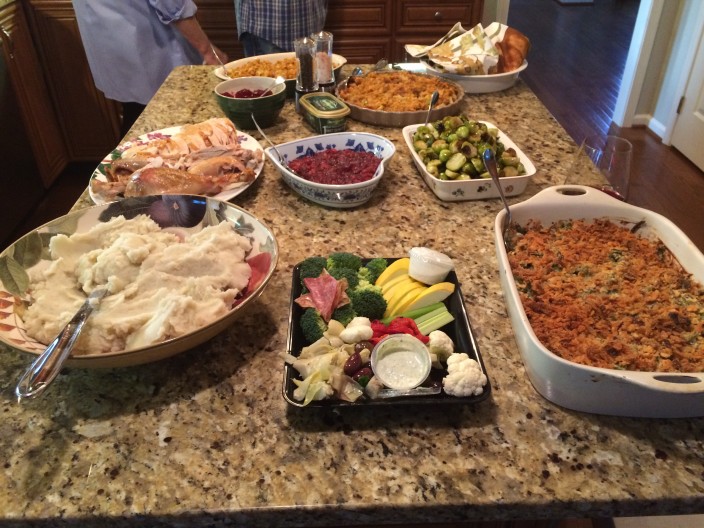
Locate an element on the screen. The image size is (704, 528). casserole is located at coordinates (598, 296).